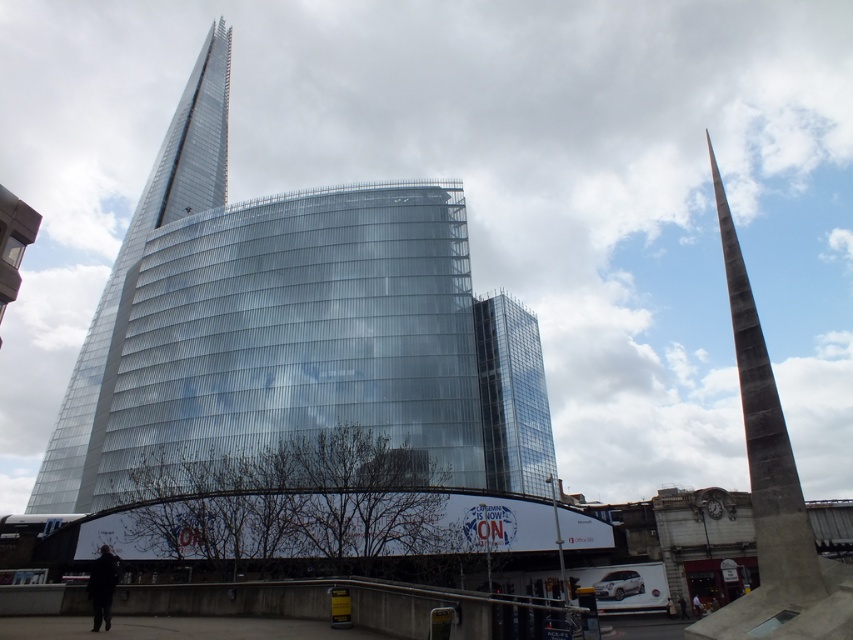
Question: Which object is closer to the camera taking this photo?

Choices:
 (A) rustic concrete spire at right
 (B) shiny glass spire at left

Answer: (A)

Question: Among these points, which one is farthest from the camera?

Choices:
 (A) (791, 556)
 (B) (45, 449)

Answer: (B)

Question: Does shiny glass spire at left appear under rustic concrete spire at right?

Choices:
 (A) yes
 (B) no

Answer: (B)

Question: Does shiny glass spire at left appear under rustic concrete spire at right?

Choices:
 (A) no
 (B) yes

Answer: (A)

Question: Is shiny glass spire at left closer to camera compared to rustic concrete spire at right?

Choices:
 (A) yes
 (B) no

Answer: (B)